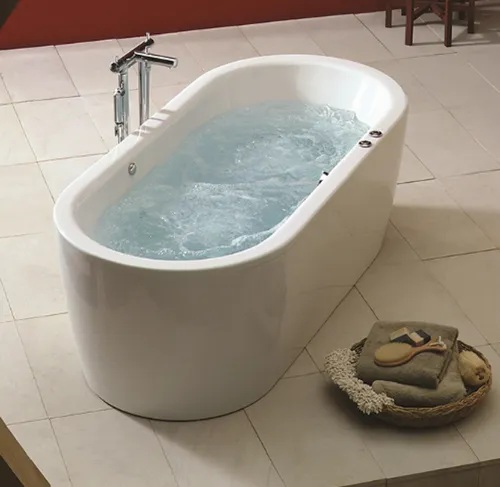
Locate an element on the screen. Image resolution: width=500 pixels, height=487 pixels. soap is located at coordinates (400, 335), (418, 338).